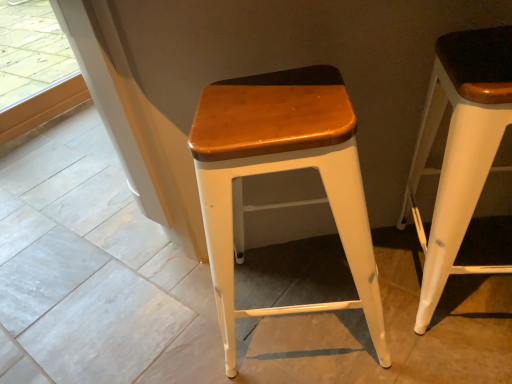
This screenshot has width=512, height=384. What do you see at coordinates (460, 149) in the screenshot? I see `white matte wood stool at right, positioned as the 1th stool in right-to-left order` at bounding box center [460, 149].

How much space does white matte wood stool at right, positioned as the 1th stool in right-to-left order, occupy horizontally?

white matte wood stool at right, positioned as the 1th stool in right-to-left order, is 15.96 inches in width.

How much space does white matte wood stool at right, acting as the second stool starting from the left, occupy vertically?

The height of white matte wood stool at right, acting as the second stool starting from the left, is 26.16 inches.

This screenshot has height=384, width=512. Identify the location of white matte wood stool at right, acting as the second stool starting from the left. (460, 149).

What is the approximate width of wooden seat at center, the first stool from the left?

wooden seat at center, the first stool from the left, is 16.62 inches in width.

Describe the element at coordinates (279, 171) in the screenshot. The width and height of the screenshot is (512, 384). I see `wooden seat at center, the 2th stool from the right` at that location.

Locate an element on the screen. The width and height of the screenshot is (512, 384). wooden seat at center, the first stool from the left is located at coordinates (279, 171).

Locate an element on the screen. This screenshot has width=512, height=384. white matte wood stool at right, acting as the second stool starting from the left is located at coordinates (460, 149).

Considering the positions of objects wooden seat at center, the 2th stool from the right, and white matte wood stool at right, positioned as the 1th stool in right-to-left order, in the image provided, who is more to the right, wooden seat at center, the 2th stool from the right, or white matte wood stool at right, positioned as the 1th stool in right-to-left order,?

Positioned to the right is white matte wood stool at right, positioned as the 1th stool in right-to-left order.

Considering the positions of objects wooden seat at center, the first stool from the left, and white matte wood stool at right, positioned as the 1th stool in right-to-left order, in the image provided, who is behind, wooden seat at center, the first stool from the left, or white matte wood stool at right, positioned as the 1th stool in right-to-left order,?

wooden seat at center, the first stool from the left, is more distant.

Is point (219, 219) closer to viewer compared to point (414, 204)?

Yes, point (219, 219) is closer to viewer.

From the image's perspective, does wooden seat at center, the 2th stool from the right, appear lower than white matte wood stool at right, positioned as the 1th stool in right-to-left order?

Yes, from the image's perspective, wooden seat at center, the 2th stool from the right, is below white matte wood stool at right, positioned as the 1th stool in right-to-left order.

From a real-world perspective, between wooden seat at center, the 2th stool from the right, and white matte wood stool at right, acting as the second stool starting from the left, who is vertically higher?

white matte wood stool at right, acting as the second stool starting from the left.

In terms of width, does wooden seat at center, the first stool from the left, look wider or thinner when compared to white matte wood stool at right, positioned as the 1th stool in right-to-left order?

Clearly, wooden seat at center, the first stool from the left, has more width compared to white matte wood stool at right, positioned as the 1th stool in right-to-left order.

Is wooden seat at center, the first stool from the left, taller than white matte wood stool at right, acting as the second stool starting from the left?

In fact, wooden seat at center, the first stool from the left, may be shorter than white matte wood stool at right, acting as the second stool starting from the left.

Between wooden seat at center, the first stool from the left, and white matte wood stool at right, acting as the second stool starting from the left, which one has smaller size?

white matte wood stool at right, acting as the second stool starting from the left.

Which is correct: wooden seat at center, the first stool from the left, is inside white matte wood stool at right, acting as the second stool starting from the left, or outside of it?

wooden seat at center, the first stool from the left, is spatially situated outside white matte wood stool at right, acting as the second stool starting from the left.

Can you see wooden seat at center, the 2th stool from the right, touching white matte wood stool at right, acting as the second stool starting from the left?

No, wooden seat at center, the 2th stool from the right, is not making contact with white matte wood stool at right, acting as the second stool starting from the left.

Does wooden seat at center, the 2th stool from the right, turn towards white matte wood stool at right, acting as the second stool starting from the left?

No, wooden seat at center, the 2th stool from the right, is not aimed at white matte wood stool at right, acting as the second stool starting from the left.

What's the angular difference between wooden seat at center, the 2th stool from the right, and white matte wood stool at right, acting as the second stool starting from the left,'s facing directions?

The facing directions of wooden seat at center, the 2th stool from the right, and white matte wood stool at right, acting as the second stool starting from the left, are 7.01 degrees apart.

This screenshot has width=512, height=384. In order to click on stool in front of the wooden seat at center, the 2th stool from the right in this screenshot , I will do `click(460, 149)`.

Considering the positions of objects white matte wood stool at right, positioned as the 1th stool in right-to-left order, and wooden seat at center, the first stool from the left, in the image provided, who is more to the left, white matte wood stool at right, positioned as the 1th stool in right-to-left order, or wooden seat at center, the first stool from the left,?

wooden seat at center, the first stool from the left.

Is white matte wood stool at right, positioned as the 1th stool in right-to-left order, positioned before wooden seat at center, the 2th stool from the right?

Yes, it is.

Which is further, [434,212] or [345,101]?

The point [434,212] is farther.

Looking at this image, from the image's perspective, does white matte wood stool at right, positioned as the 1th stool in right-to-left order, appear higher than wooden seat at center, the 2th stool from the right?

Yes.

From a real-world perspective, is white matte wood stool at right, acting as the second stool starting from the left, physically above wooden seat at center, the 2th stool from the right?

Yes, from a real-world perspective, white matte wood stool at right, acting as the second stool starting from the left, is above wooden seat at center, the 2th stool from the right.

Which object is wider, white matte wood stool at right, acting as the second stool starting from the left, or wooden seat at center, the first stool from the left?

wooden seat at center, the first stool from the left, is wider.

Which of these two, white matte wood stool at right, acting as the second stool starting from the left, or wooden seat at center, the 2th stool from the right, stands shorter?

wooden seat at center, the 2th stool from the right, is shorter.

Considering the sizes of white matte wood stool at right, acting as the second stool starting from the left, and wooden seat at center, the 2th stool from the right, in the image, is white matte wood stool at right, acting as the second stool starting from the left, bigger or smaller than wooden seat at center, the 2th stool from the right,?

white matte wood stool at right, acting as the second stool starting from the left, is smaller than wooden seat at center, the 2th stool from the right.

Would you say white matte wood stool at right, acting as the second stool starting from the left, is outside wooden seat at center, the 2th stool from the right?

Yes.

Looking at this image, are white matte wood stool at right, acting as the second stool starting from the left, and wooden seat at center, the first stool from the left, located far from each other?

That's not correct — white matte wood stool at right, acting as the second stool starting from the left, is a little close to wooden seat at center, the first stool from the left.

Does white matte wood stool at right, positioned as the 1th stool in right-to-left order, turn towards wooden seat at center, the first stool from the left?

No, white matte wood stool at right, positioned as the 1th stool in right-to-left order, is not facing towards wooden seat at center, the first stool from the left.

How much distance is there between white matte wood stool at right, positioned as the 1th stool in right-to-left order, and wooden seat at center, the 2th stool from the right?

white matte wood stool at right, positioned as the 1th stool in right-to-left order, and wooden seat at center, the 2th stool from the right, are 12.30 inches apart.

At what (x,y) coordinates should I click in order to perform the action: click on stool that is behind the white matte wood stool at right, acting as the second stool starting from the left. Please return your answer as a coordinate pair (x, y). The width and height of the screenshot is (512, 384). Looking at the image, I should click on 279,171.

This screenshot has width=512, height=384. I want to click on stool on the right of wooden seat at center, the 2th stool from the right, so click(460, 149).

Where is `stool located on the left of white matte wood stool at right, positioned as the 1th stool in right-to-left order`? The width and height of the screenshot is (512, 384). stool located on the left of white matte wood stool at right, positioned as the 1th stool in right-to-left order is located at coordinates (279, 171).